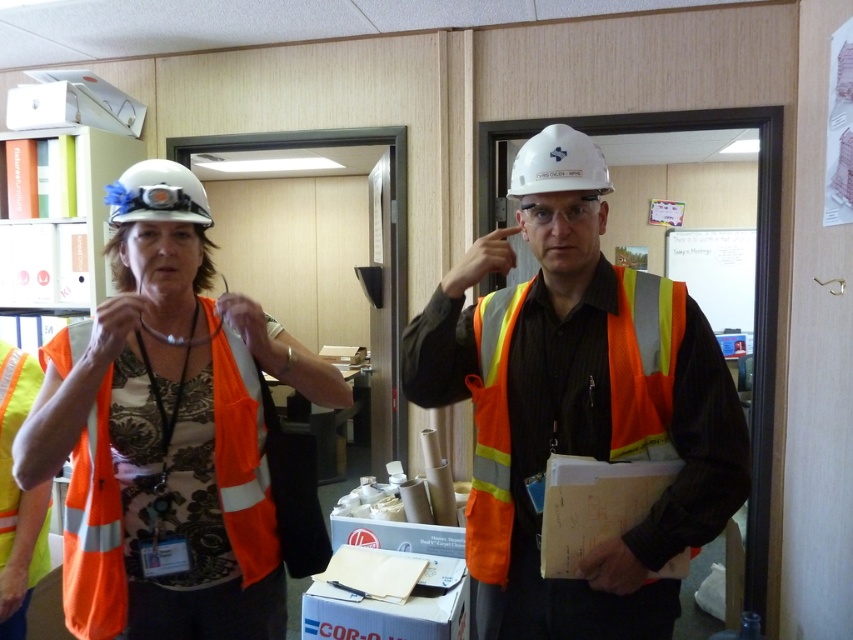
You are an inspector checking safety gear dimensions in the office. The orange reflective safety vest at center and the white hard hat at upper center are both in front of you. Based on their widths, which one is wider?

The orange reflective safety vest at center is wider than the white hard hat at upper center according to the description.